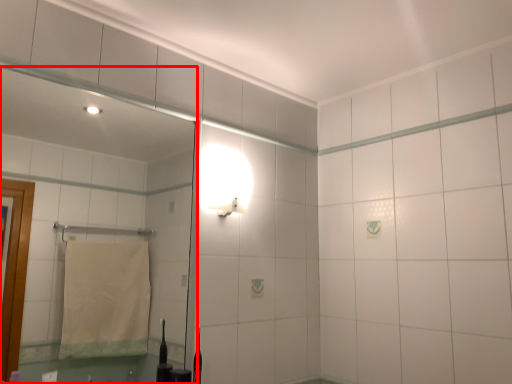
Question: From the image's perspective, what is the correct spatial positioning of mirror (annotated by the red box) in reference to light fixture?

Choices:
 (A) below
 (B) above

Answer: (A)